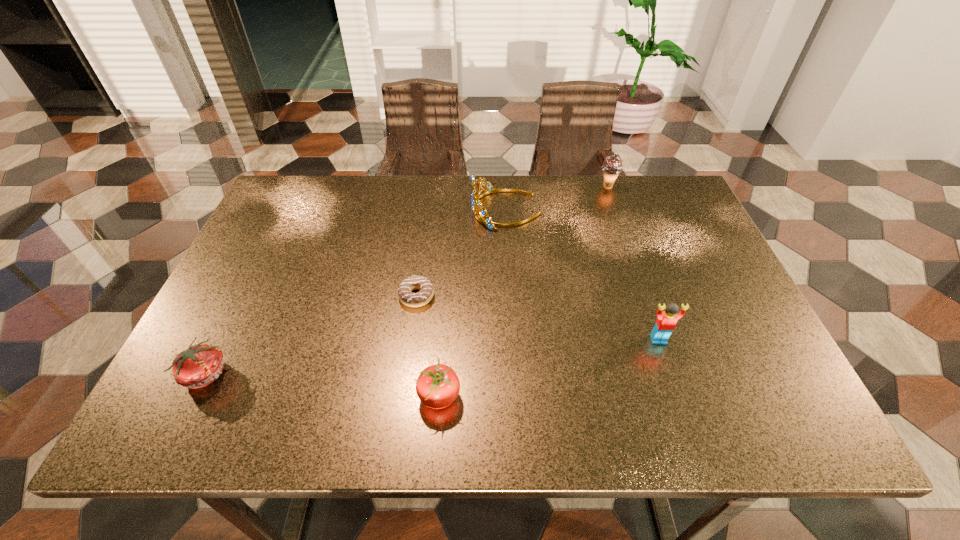
You are a GUI agent. You are given a task and a screenshot of the screen. Output one action in this format:
    pyautogui.click(x=<x>, y=<y>)
    Task: Click on the icecream
    
    Given the screenshot: What is the action you would take?
    pyautogui.click(x=612, y=166)

You are a GUI agent. You are given a task and a screenshot of the screen. Output one action in this format:
    pyautogui.click(x=<x>, y=<y>)
    Task: Click on the tiara
    
    Given the screenshot: What is the action you would take?
    pyautogui.click(x=482, y=217)

Identify the location of the third nearest object. (666, 321).

In order to click on the right tomato in this screenshot , I will do `click(438, 386)`.

Locate an element on the screen. the left tomato is located at coordinates (196, 367).

You are a GUI agent. You are given a task and a screenshot of the screen. Output one action in this format:
    pyautogui.click(x=<x>, y=<y>)
    Task: Click on the shortest object
    
    Given the screenshot: What is the action you would take?
    pyautogui.click(x=405, y=295)

Locate an element on the screen. Image resolution: width=960 pixels, height=540 pixels. the third farthest object is located at coordinates (405, 295).

The width and height of the screenshot is (960, 540). In order to click on blank area located on the front of the icecream in this screenshot , I will do `click(637, 271)`.

Find the location of a particular element. This screenshot has height=540, width=960. free space located 0.330m on the front-facing side of the fourth object from left to right is located at coordinates (357, 210).

You are a GUI agent. You are given a task and a screenshot of the screen. Output one action in this format:
    pyautogui.click(x=<x>, y=<y>)
    Task: Click on the vacant area situated 0.220m on the front-facing side of the fourth object from left to right
    The width and height of the screenshot is (960, 540).
    Given the screenshot: What is the action you would take?
    pyautogui.click(x=395, y=210)